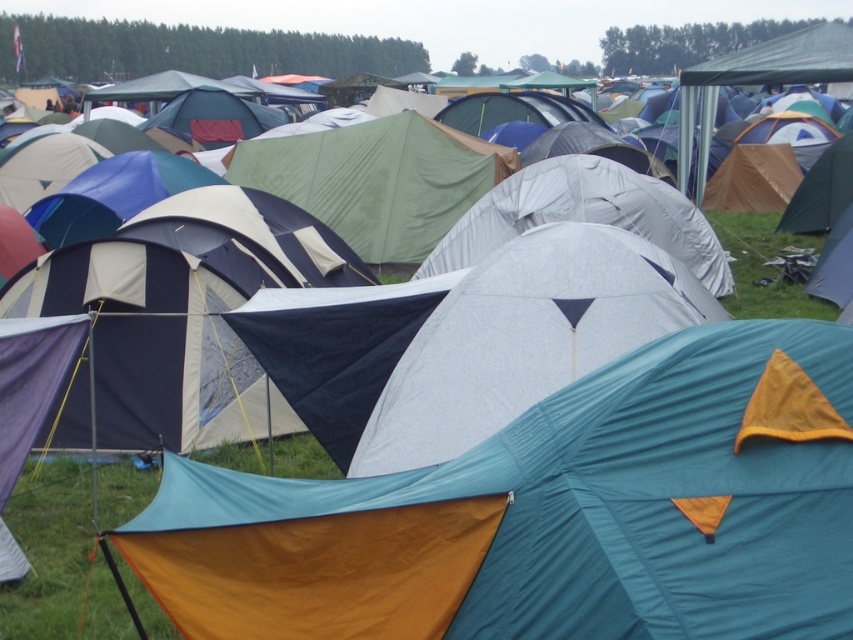
Question: Which object appears farthest from the camera in this image?

Choices:
 (A) green grass at lower right
 (B) teal fabric tent at center

Answer: (A)

Question: In this image, where is teal fabric tent at center located relative to green grass at lower right?

Choices:
 (A) above
 (B) below

Answer: (B)

Question: Is teal fabric tent at center bigger than green grass at lower right?

Choices:
 (A) yes
 (B) no

Answer: (A)

Question: Does teal fabric tent at center have a smaller size compared to green grass at lower right?

Choices:
 (A) no
 (B) yes

Answer: (A)

Question: Which point is closer to the camera?

Choices:
 (A) teal fabric tent at center
 (B) green grass at lower right

Answer: (A)